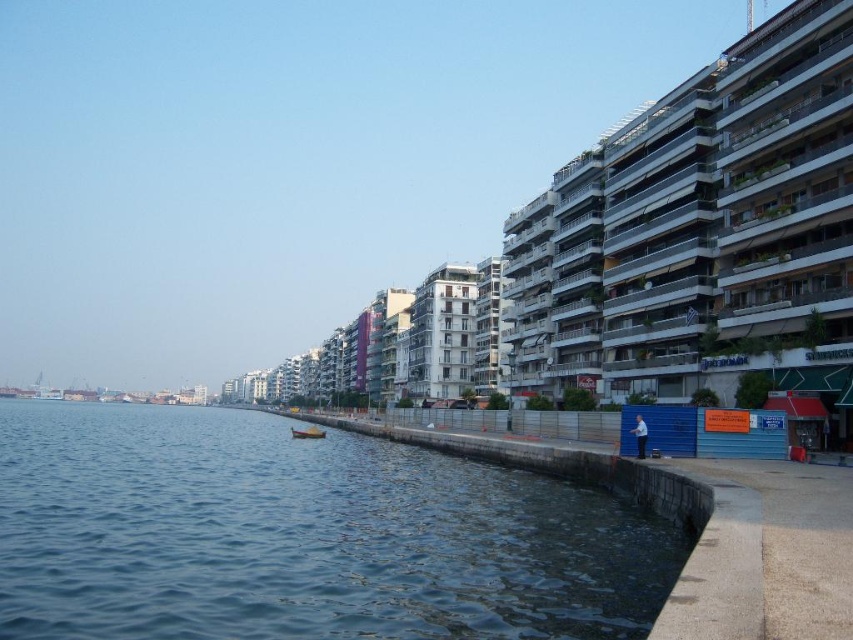
Question: Which point is closer to the camera taking this photo?

Choices:
 (A) (582, 500)
 (B) (291, 429)

Answer: (A)

Question: Does blue water at lower left have a larger size compared to wooden boat at lower left?

Choices:
 (A) yes
 (B) no

Answer: (A)

Question: Is blue water at lower left positioned in front of wooden boat at lower left?

Choices:
 (A) no
 (B) yes

Answer: (B)

Question: Observing the image, what is the correct spatial positioning of blue water at lower left in reference to wooden boat at lower left?

Choices:
 (A) right
 (B) left

Answer: (B)